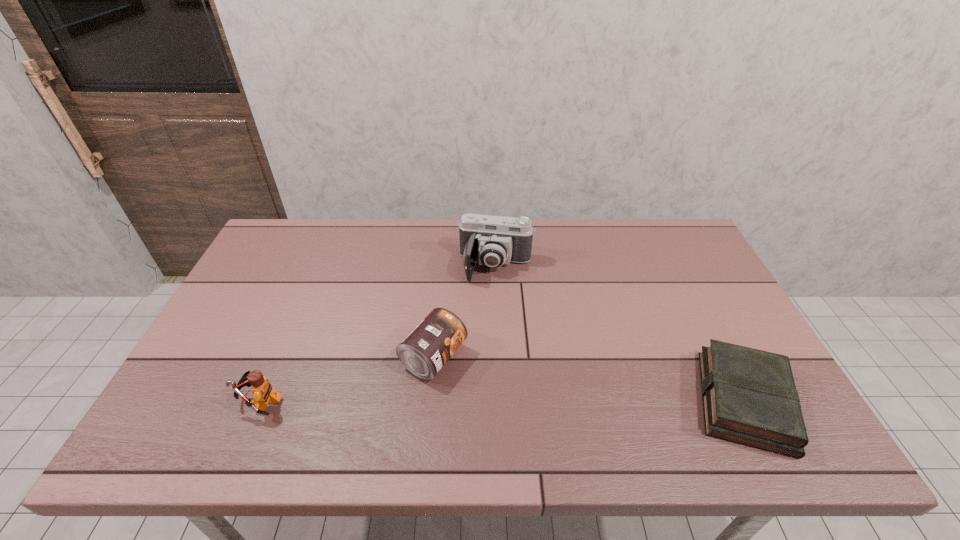
Find the location of `Lego`. Lego is located at coordinates (262, 390).

The image size is (960, 540). I want to click on book, so click(x=749, y=396).

Where is `the rightmost object`? This screenshot has width=960, height=540. the rightmost object is located at coordinates (749, 396).

This screenshot has height=540, width=960. I want to click on the tallest object, so tap(492, 241).

At what (x,y) coordinates should I click in order to perform the action: click on camera. Please return your answer as a coordinate pair (x, y). Image resolution: width=960 pixels, height=540 pixels. Looking at the image, I should click on (492, 241).

Identify the location of can. (430, 345).

The image size is (960, 540). I want to click on free space located holding a crossbow in the hands of the Lego, so click(196, 401).

Find the location of a particular element. The image size is (960, 540). vacant area located 0.050m holding a crossbow in the hands of the Lego is located at coordinates (217, 401).

At what (x,y) coordinates should I click in order to perform the action: click on free space located holding a crossbow in the hands of the Lego. Please return your answer as a coordinate pair (x, y). This screenshot has height=540, width=960. Looking at the image, I should click on (208, 401).

Locate an element on the screen. The image size is (960, 540). free point located 0.120m on the back of the shortest object is located at coordinates (703, 319).